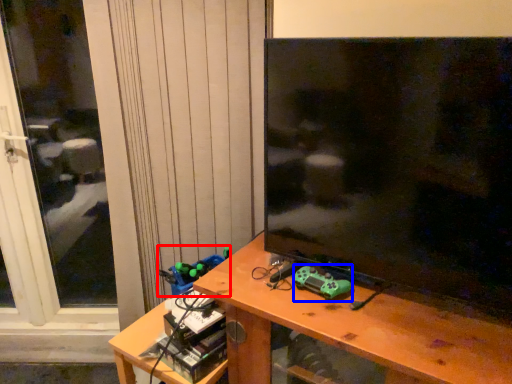
Question: Which of the following is the closest to the observer, toy (highlighted by a red box) or toy (highlighted by a blue box)?

Choices:
 (A) toy
 (B) toy

Answer: (B)